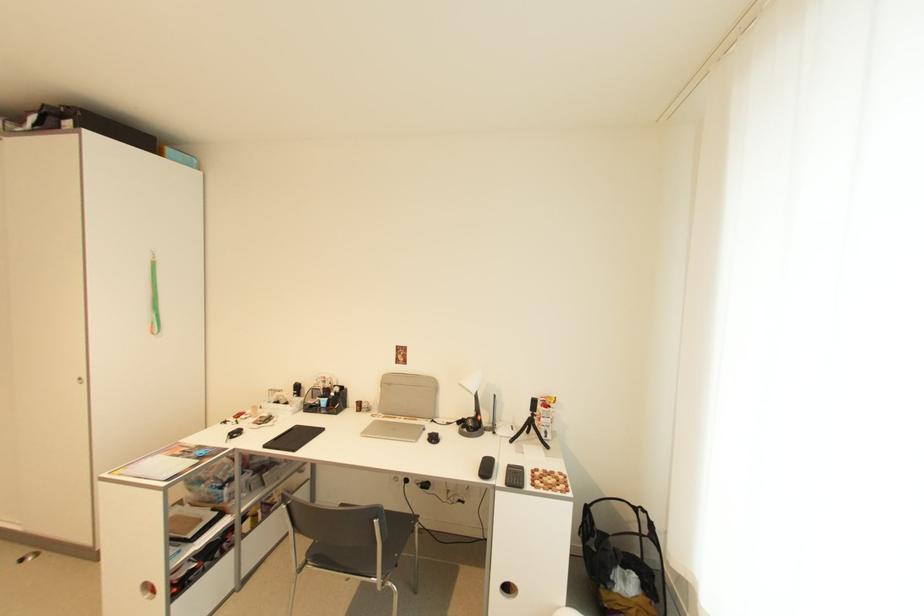
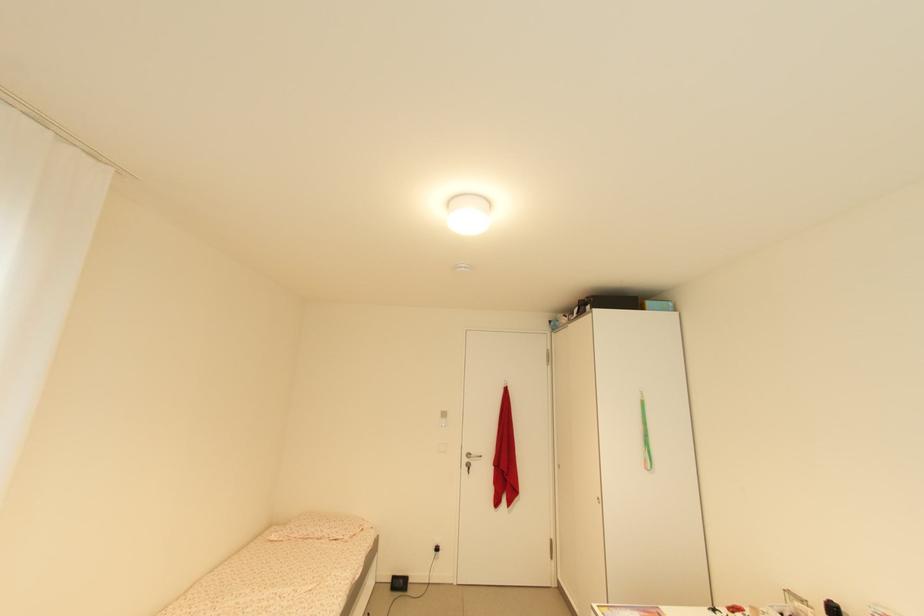
First-person continuous shooting, in which direction is the camera rotating?

The rotation direction of the camera is left-up.